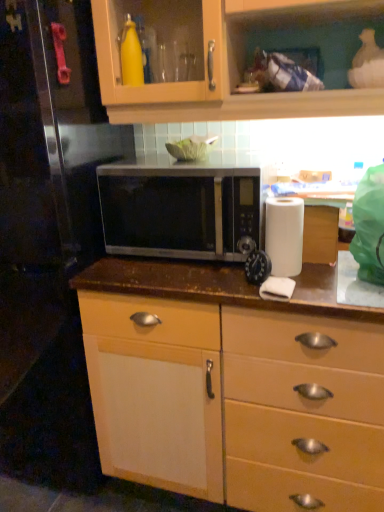
Locate an element on the screen. The width and height of the screenshot is (384, 512). free area in between satin silver microwave at center and black plastic clock at center is located at coordinates (188, 274).